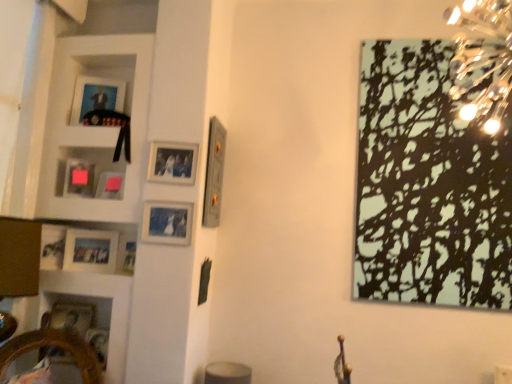
Question: Based on their sizes in the image, would you say matte glass picture frame at center-left, which appears as the fourth picture frame when viewed from the right, is bigger or smaller than matte pink picture frame at upper left, arranged as the ninth picture frame when viewed from the right?

Choices:
 (A) big
 (B) small

Answer: (B)

Question: Does point (157, 240) appear closer or farther from the camera than point (70, 162)?

Choices:
 (A) closer
 (B) farther

Answer: (A)

Question: Which object is the closest to the white glossy cabinet at upper left?

Choices:
 (A) metallic silver picture frame at center, the second picture frame viewed from the right
 (B) matte wooden picture frame at left, the seventh picture frame in the right-to-left sequence
 (C) wooden mirror at lower left
 (D) black matte picture frame at upper right, marked as the 1th picture frame in a right-to-left arrangement
 (E) matte silver picture frame at upper center, the eighth picture frame positioned from the left

Answer: (E)

Question: Based on their relative distances, which object is farther from the wooden mirror at lower left?

Choices:
 (A) matte plastic picture frame at upper left, the 5th picture frame viewed from the left
 (B) matte black picture frame at upper left, which appears as the 8th picture frame when viewed from the right
 (C) matte glass picture frame at center-left, the seventh picture frame when ordered from left to right
 (D) wooden photo frame at lower left, the 10th picture frame in the right-to-left sequence
 (E) matte wooden picture frame at left, the seventh picture frame in the right-to-left sequence

Answer: (B)